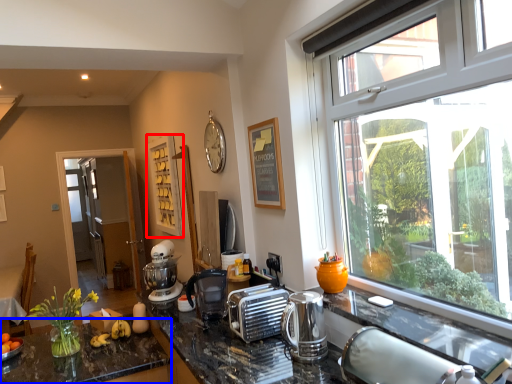
Question: Which point is closer to the camera, shelf (highlighted by a red box) or countertop (highlighted by a blue box)?

Choices:
 (A) shelf
 (B) countertop

Answer: (B)